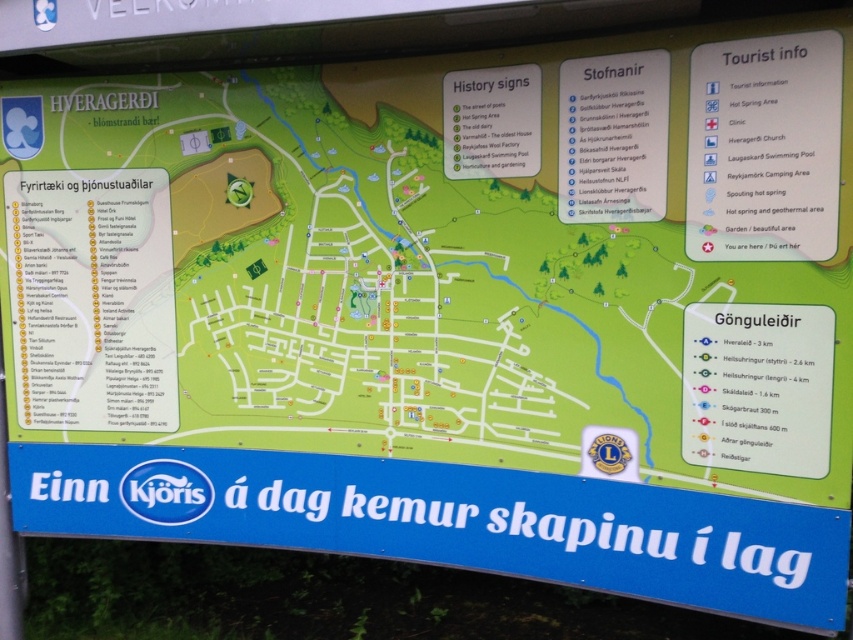
Can you confirm if white paper sign at upper center is positioned to the left of green paper history signs at upper center?

In fact, white paper sign at upper center is to the right of green paper history signs at upper center.

Is white paper sign at upper center positioned before green paper history signs at upper center?

Yes, it is in front of green paper history signs at upper center.

Is point (645, 141) behind point (535, 106)?

That is False.

Identify the location of white paper sign at upper center. This screenshot has width=853, height=640. (613, 138).

Who is shorter, white paper at upper right or green paper history signs at upper center?

green paper history signs at upper center is shorter.

Which is in front, point (712, 97) or point (471, 177)?

Point (712, 97) is more forward.

Where is `white paper at upper right`? white paper at upper right is located at coordinates (764, 147).

Can you confirm if white paper at upper right is positioned above white paper sign at upper center?

No.

Based on the photo, who is positioned more to the right, white paper at upper right or white paper sign at upper center?

white paper at upper right is more to the right.

Is point (712, 51) in front of point (662, 115)?

Yes, point (712, 51) is in front of point (662, 115).

The height and width of the screenshot is (640, 853). In order to click on white paper at upper right in this screenshot , I will do `click(764, 147)`.